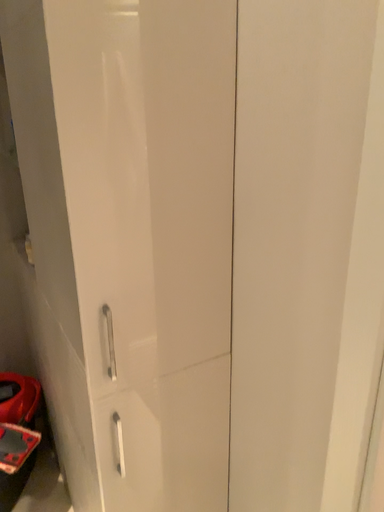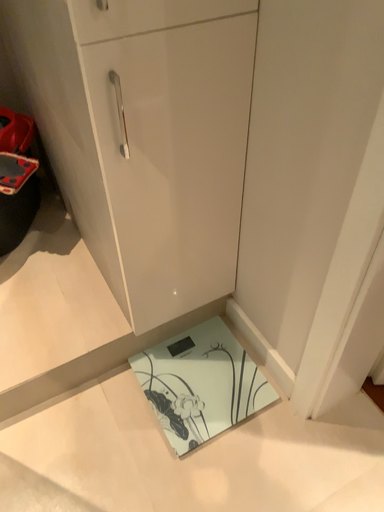
Question: Which way did the camera rotate in the video?

Choices:
 (A) rotated upward
 (B) rotated downward

Answer: (B)